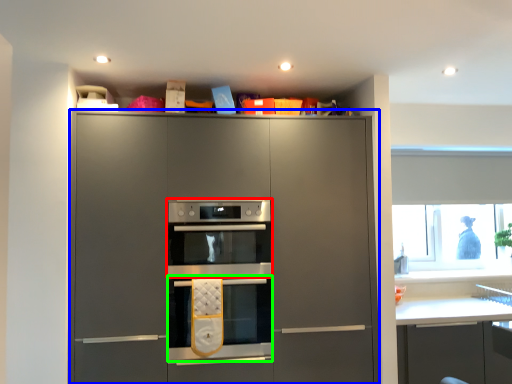
Question: Which object is the farthest from oven (highlighted by a red box)? Choose among these: cabinetry (highlighted by a blue box) or oven (highlighted by a green box).

Choices:
 (A) cabinetry
 (B) oven

Answer: (B)